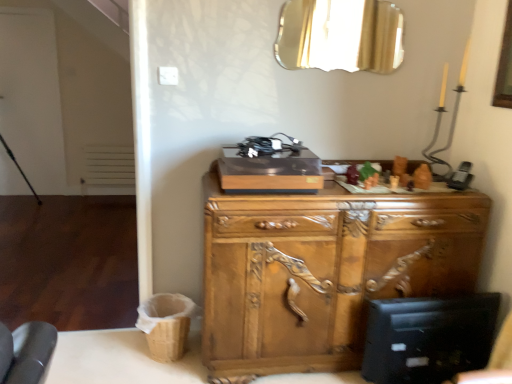
In order to click on clear glass mirror at upper center in this screenshot , I will do `click(340, 35)`.

Describe the element at coordinates (340, 35) in the screenshot. I see `clear glass mirror at upper center` at that location.

The width and height of the screenshot is (512, 384). I want to click on wooden carved cabinet at center, so click(324, 270).

This screenshot has width=512, height=384. What do you see at coordinates (324, 270) in the screenshot?
I see `wooden carved cabinet at center` at bounding box center [324, 270].

Identify the location of clear glass mirror at upper center. Image resolution: width=512 pixels, height=384 pixels. (340, 35).

Between clear glass mirror at upper center and wooden carved cabinet at center, which one appears on the right side from the viewer's perspective?

From the viewer's perspective, clear glass mirror at upper center appears more on the right side.

Which object is further away from the camera, clear glass mirror at upper center or wooden carved cabinet at center?

clear glass mirror at upper center is behind.

Does point (316, 23) come in front of point (366, 212)?

No.

From the image's perspective, is clear glass mirror at upper center over wooden carved cabinet at center?

Yes, from the image's perspective, clear glass mirror at upper center is over wooden carved cabinet at center.

Looking at this image, from a real-world perspective, relative to wooden carved cabinet at center, is clear glass mirror at upper center vertically above or below?

clear glass mirror at upper center is above wooden carved cabinet at center.

Is clear glass mirror at upper center wider than wooden carved cabinet at center?

No, clear glass mirror at upper center is not wider than wooden carved cabinet at center.

Consider the image. Does clear glass mirror at upper center have a lesser height compared to wooden carved cabinet at center?

Yes.

Looking at the image, does clear glass mirror at upper center seem bigger or smaller compared to wooden carved cabinet at center?

clear glass mirror at upper center is smaller than wooden carved cabinet at center.

Would you say wooden carved cabinet at center is part of clear glass mirror at upper center's contents?

No, wooden carved cabinet at center is not a part of clear glass mirror at upper center.

Is clear glass mirror at upper center directly adjacent to wooden carved cabinet at center?

No.

Is clear glass mirror at upper center facing towards wooden carved cabinet at center?

No, clear glass mirror at upper center is not oriented towards wooden carved cabinet at center.

Can you tell me how much clear glass mirror at upper center and wooden carved cabinet at center differ in facing direction?

The facing directions of clear glass mirror at upper center and wooden carved cabinet at center are 0.425 degrees apart.

Measure the distance from clear glass mirror at upper center to wooden carved cabinet at center.

clear glass mirror at upper center is 3.38 feet from wooden carved cabinet at center.

Find the location of a particular element. This screenshot has height=384, width=512. mirror above the wooden carved cabinet at center (from the image's perspective) is located at coordinates (340, 35).

Looking at this image, would you say wooden carved cabinet at center is to the left or to the right of clear glass mirror at upper center in the picture?

Based on their positions, wooden carved cabinet at center is located to the left of clear glass mirror at upper center.

Relative to clear glass mirror at upper center, is wooden carved cabinet at center in front or behind?

wooden carved cabinet at center is in front of clear glass mirror at upper center.

Is point (286, 330) in front of point (292, 49)?

Yes.

From the picture: From the image's perspective, is wooden carved cabinet at center over clear glass mirror at upper center?

No.

From a real-world perspective, which object stands above the other?

clear glass mirror at upper center is physically above.

Can you confirm if wooden carved cabinet at center is thinner than clear glass mirror at upper center?

In fact, wooden carved cabinet at center might be wider than clear glass mirror at upper center.

Considering the sizes of objects wooden carved cabinet at center and clear glass mirror at upper center in the image provided, who is taller, wooden carved cabinet at center or clear glass mirror at upper center?

With more height is wooden carved cabinet at center.

Is wooden carved cabinet at center bigger or smaller than clear glass mirror at upper center?

Considering their sizes, wooden carved cabinet at center takes up more space than clear glass mirror at upper center.

Is clear glass mirror at upper center surrounded by wooden carved cabinet at center?

No, clear glass mirror at upper center is not surrounded by wooden carved cabinet at center.

Is there a large distance between wooden carved cabinet at center and clear glass mirror at upper center?

Indeed, wooden carved cabinet at center is not near clear glass mirror at upper center.

Is wooden carved cabinet at center facing towards clear glass mirror at upper center?

No, wooden carved cabinet at center is not turned towards clear glass mirror at upper center.

Can you tell me how much wooden carved cabinet at center and clear glass mirror at upper center differ in facing direction?

0.425 degrees.

Based on the photo, measure the distance from wooden carved cabinet at center to clear glass mirror at upper center.

wooden carved cabinet at center is 1.03 meters from clear glass mirror at upper center.

I want to click on mirror above the wooden carved cabinet at center (from the image's perspective), so click(x=340, y=35).

At what (x,y) coordinates should I click in order to perform the action: click on mirror that is on the right side of wooden carved cabinet at center. Please return your answer as a coordinate pair (x, y). The width and height of the screenshot is (512, 384). Looking at the image, I should click on (340, 35).

Image resolution: width=512 pixels, height=384 pixels. I want to click on mirror behind the wooden carved cabinet at center, so click(340, 35).